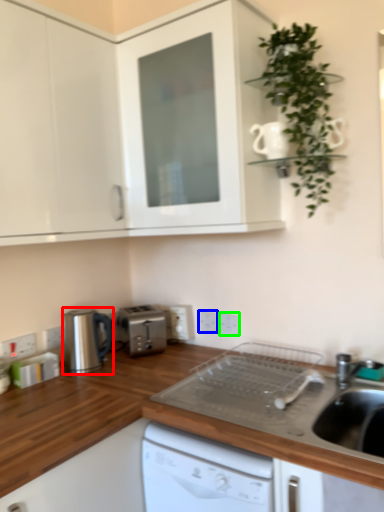
Question: Which object is the closest to the home appliance (highlighted by a red box)? Choose among these: electric outlet (highlighted by a blue box) or electric outlet (highlighted by a green box).

Choices:
 (A) electric outlet
 (B) electric outlet

Answer: (A)